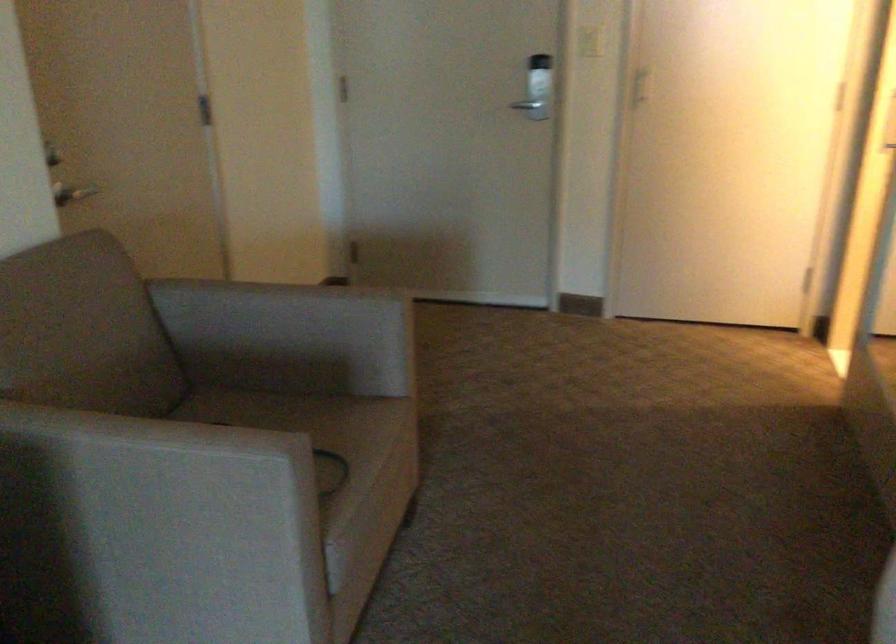
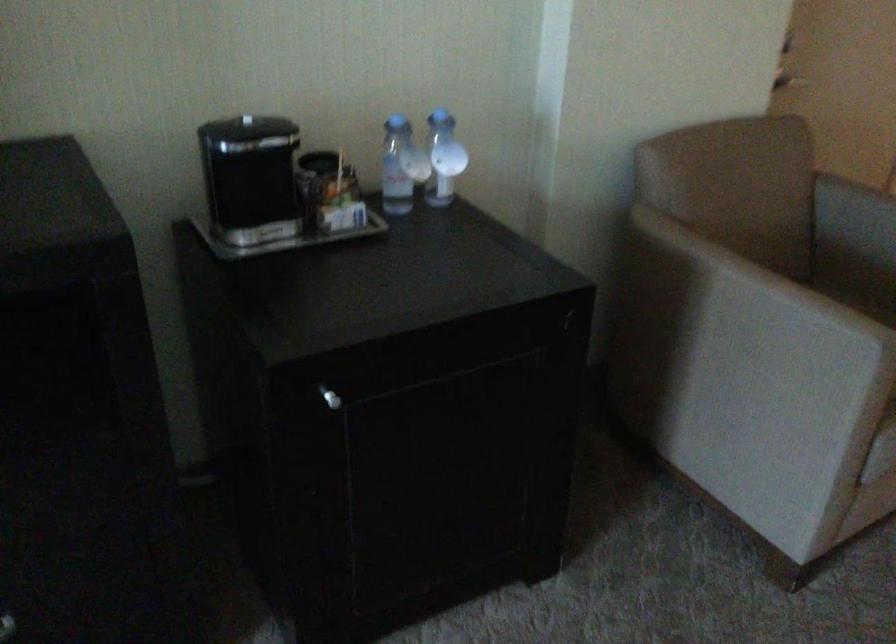
In the second image, find the point that corresponds to pixel 134 487 in the first image.

(739, 319)